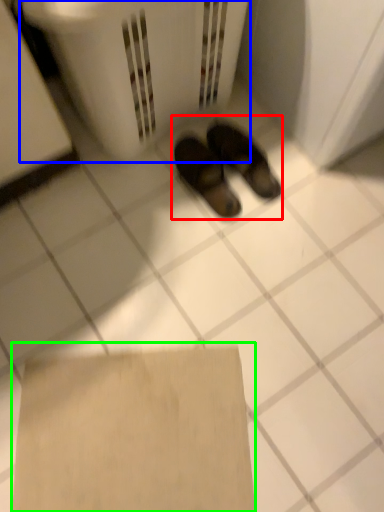
Question: Based on their relative distances, which object is nearer to footwear (highlighted by a red box)? Choose from laundry basket (highlighted by a blue box) and cardboard (highlighted by a green box).

Choices:
 (A) laundry basket
 (B) cardboard

Answer: (A)